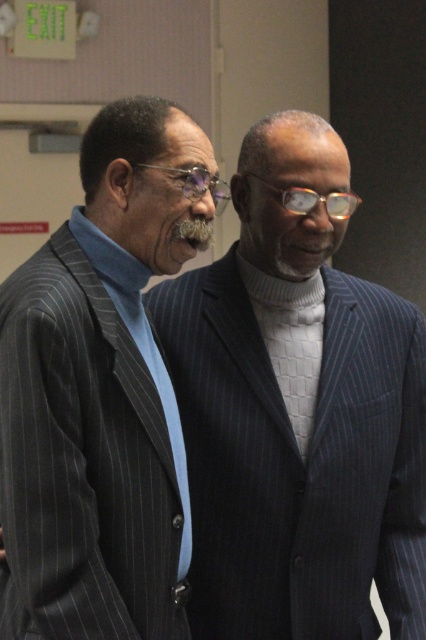
You are standing in a room and see the pinstriped suit at left and the clear plastic glasses at center. Which object is positioned further to the left?

The pinstriped suit at left is positioned further to the left than the clear plastic glasses at center.

You are an interior designer who needs to ensure that the clear plastic glasses at center can fit on a shelf that is the same size as the dark blue pinstripe suit at center. Will the glasses fit?

The dark blue pinstripe suit at center is bigger than clear plastic glasses at center, so the glasses will fit on the shelf since they are smaller in size.

You are standing in the room where the two men are. You want to place a small plant exactly at the point marked as point (336, 628). If you are 1.5 meters tall, will the plant be visible to you without bending down?

The distance of point (336, 628) from the viewer is 1.37 meters. Since the plant is placed at this point, which is closer than your height of 1.5 meters, the plant will be visible without bending down.